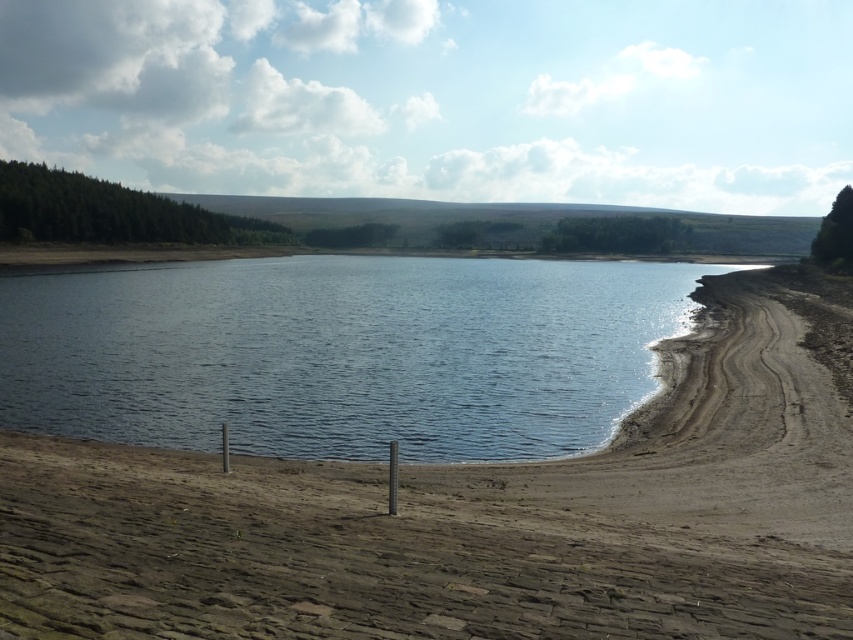
You are standing at the point marked by the coordinates point (370,557) in the image. Based on the scene description, what type of terrain are you currently standing on?

The point (370,557) corresponds to brown dry sand at lower center, so you are standing on brown dry sand.